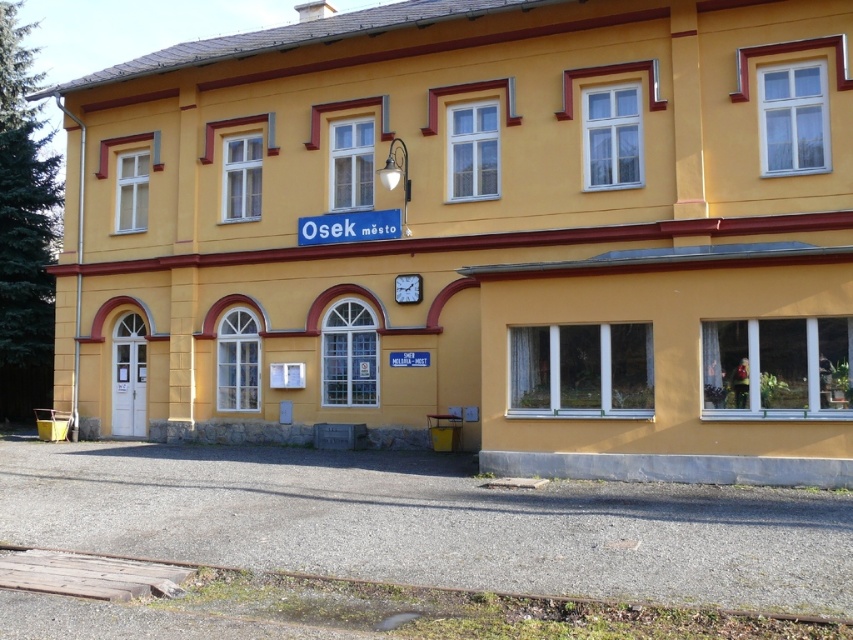
Can you confirm if matte yellow building at center is smaller than white plastic window at center?

No.

Where is `matte yellow building at center`? The image size is (853, 640). matte yellow building at center is located at coordinates (477, 236).

Is point (178, 228) in front of point (825, 292)?

No, (178, 228) is behind (825, 292).

Locate an element on the screen. The height and width of the screenshot is (640, 853). matte yellow building at center is located at coordinates (477, 236).